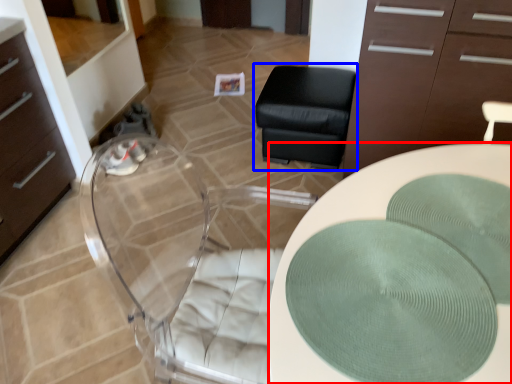
Question: Among these objects, which one is farthest to the camera, desk (highlighted by a red box) or furniture (highlighted by a blue box)?

Choices:
 (A) desk
 (B) furniture

Answer: (B)